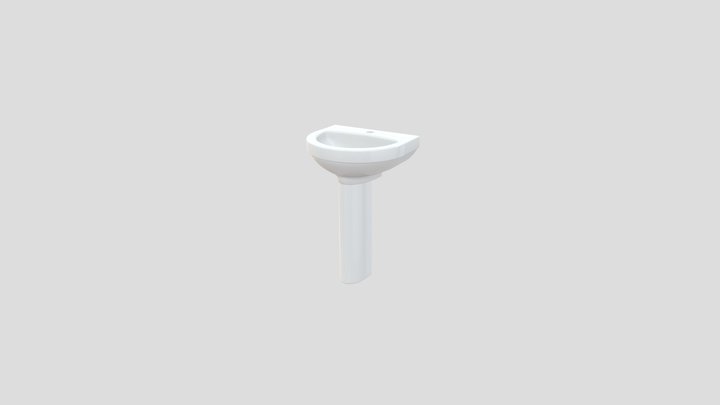
Where is `bottom of sink`? Image resolution: width=720 pixels, height=405 pixels. bottom of sink is located at coordinates pyautogui.click(x=351, y=282).